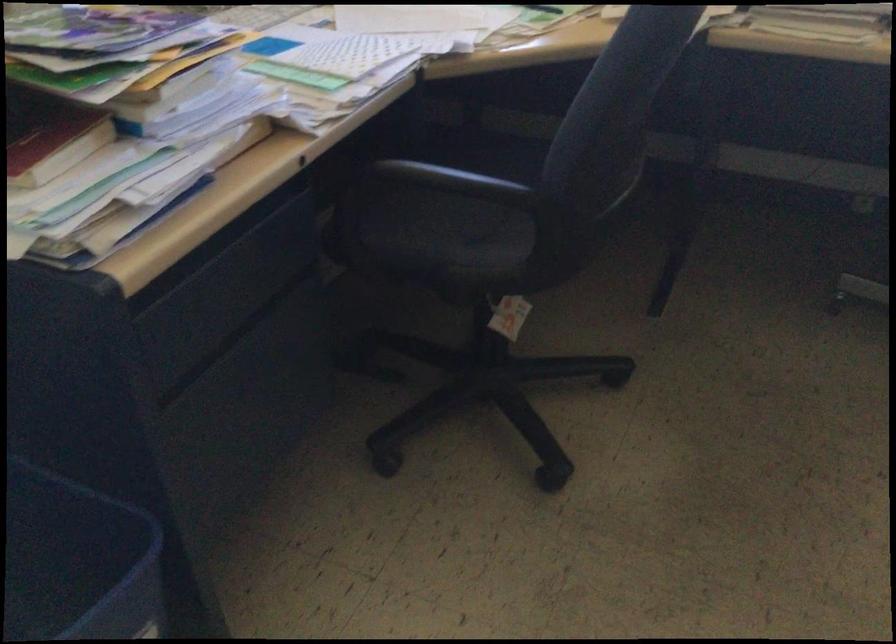
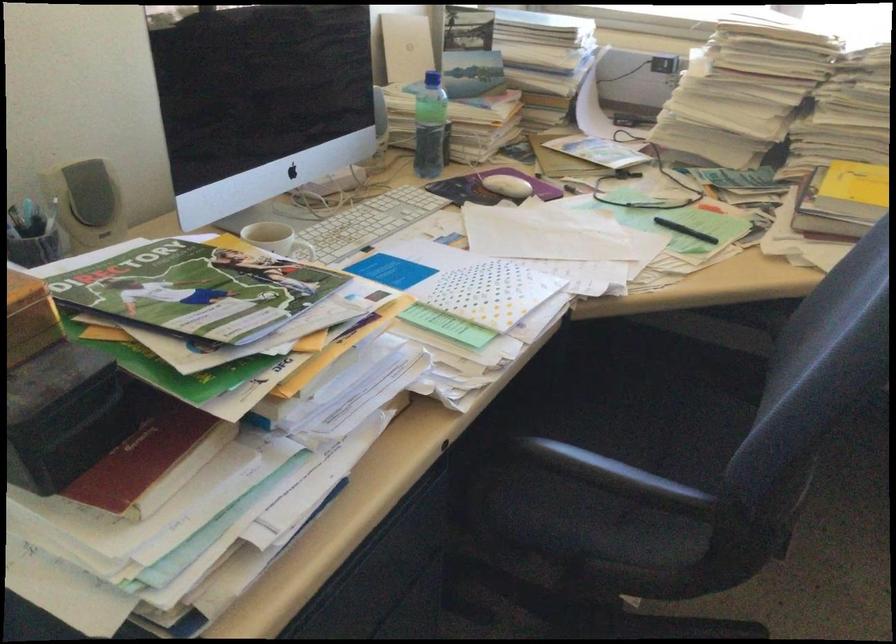
The images are taken continuously from a first-person perspective. In which direction are you moving?

The cameraman moved toward left, forward.